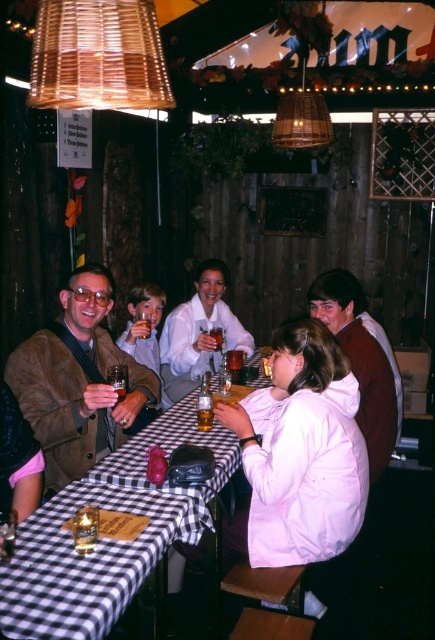
You are sitting at the table in the rustic restaurant. You need to pass a napkin from the point at coordinates point (210, 273) to someone sitting at point (74, 545). Which direction should you move the napkin to reach them?

Since point (210, 273) is behind point (74, 545), you should move the napkin forward towards point (74, 545) to reach them.

You are a bartender who needs to place a new drink order on the table. The white matte jacket at center and the translucent glass bottle at table center are already there. Which object should you place the new drink closer to so it doesn,t fall over?

The white matte jacket at center is much taller than the translucent glass bottle at table center, so placing the new drink closer to the white matte jacket at center would provide a more stable base to prevent it from falling over.

You are a server at the rustic restaurant and need to place a new drink order on the table. The order requires placing the drink exactly at the point labeled as point (x=90, y=561). Where should you place the drink on the table?

Place the drink at the point (x=90, y=561) on the black checkered tablecloth at lower left.